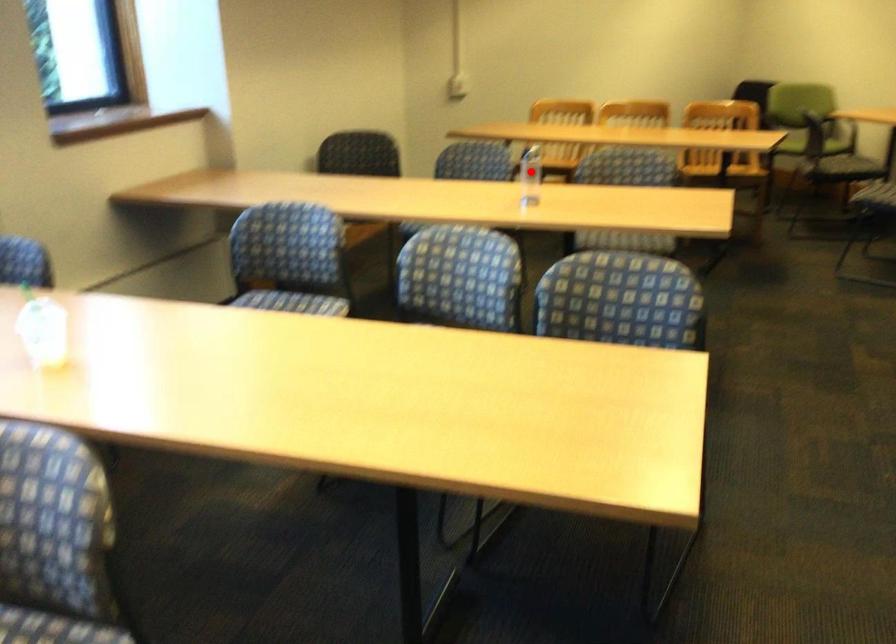
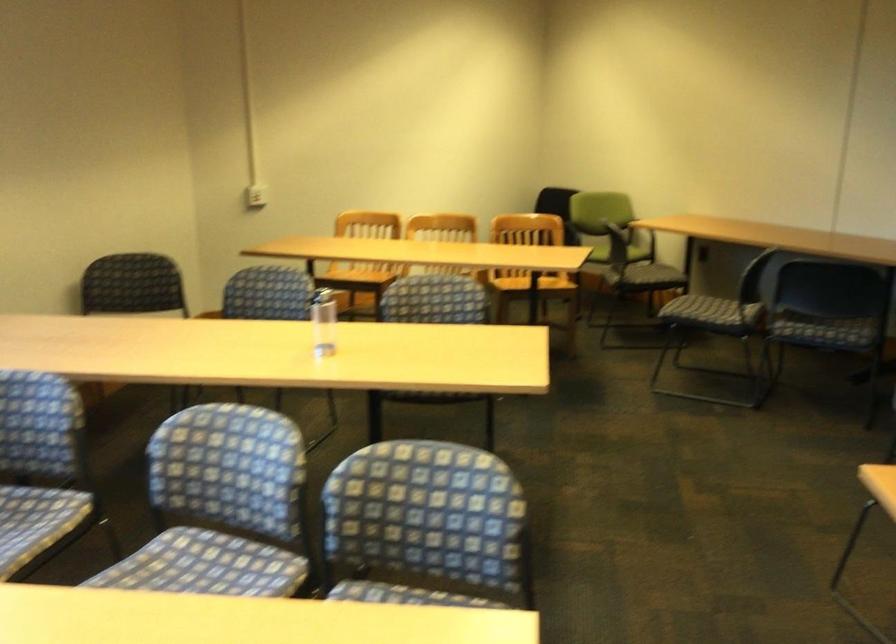
Find the pixel in the second image that matches the highlighted location in the first image.

(323, 322)